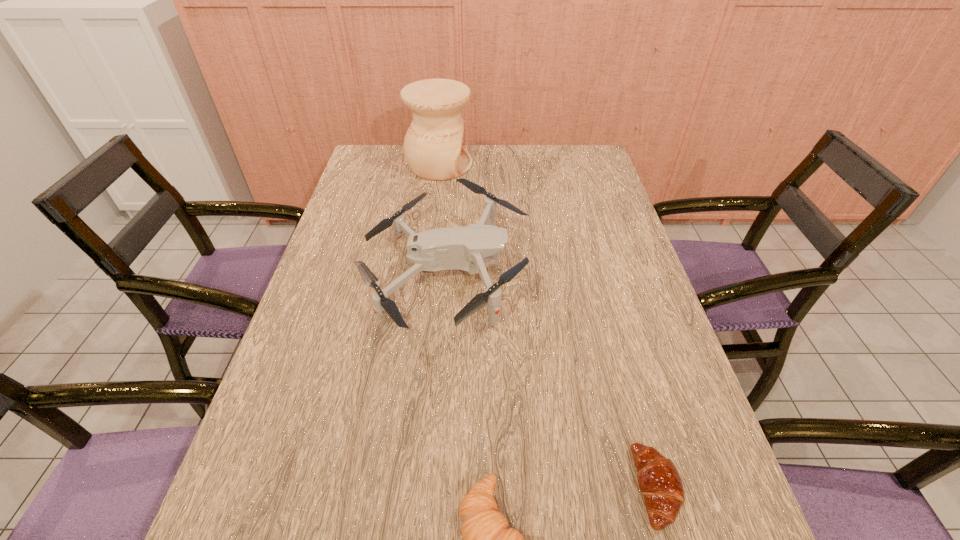
You are a GUI agent. You are given a task and a screenshot of the screen. Output one action in this format:
    pyautogui.click(x=<x>, y=<y>)
    Task: Click on the object located in the left edge section of the desktop
    This screenshot has height=540, width=960.
    Given the screenshot: What is the action you would take?
    pyautogui.click(x=467, y=248)

At what (x,y) coordinates should I click in order to perform the action: click on object that is at the right edge. Please return your answer as a coordinate pair (x, y). This screenshot has height=540, width=960. Looking at the image, I should click on (660, 484).

In the image, there is a desktop. Identify the location of vacant space at the left edge. (387, 188).

Find the location of `free space at the right edge of the desktop`. free space at the right edge of the desktop is located at coordinates (609, 200).

Locate an element on the screen. This screenshot has width=960, height=540. vacant space at the far left corner is located at coordinates (360, 163).

You are a GUI agent. You are given a task and a screenshot of the screen. Output one action in this format:
    pyautogui.click(x=<x>, y=<y>)
    Task: Click on the free space at the far right corner
    This screenshot has height=540, width=960.
    Given the screenshot: What is the action you would take?
    pyautogui.click(x=566, y=179)

Image resolution: width=960 pixels, height=540 pixels. Identify the location of free space between the pottery and the drone. (443, 220).

What are the coordinates of `free space between the tallest object and the rightmost object` in the screenshot? It's located at (548, 326).

Identify the location of vacant area between the farthest object and the shortest object. This screenshot has width=960, height=540. (548, 326).

Identify which object is located as the nearest to the farthest object. Please provide its 2D coordinates. Your answer should be formatted as a tuple, i.e. [(x, y)], where the tuple contains the x and y coordinates of a point satisfying the conditions above.

[(467, 248)]